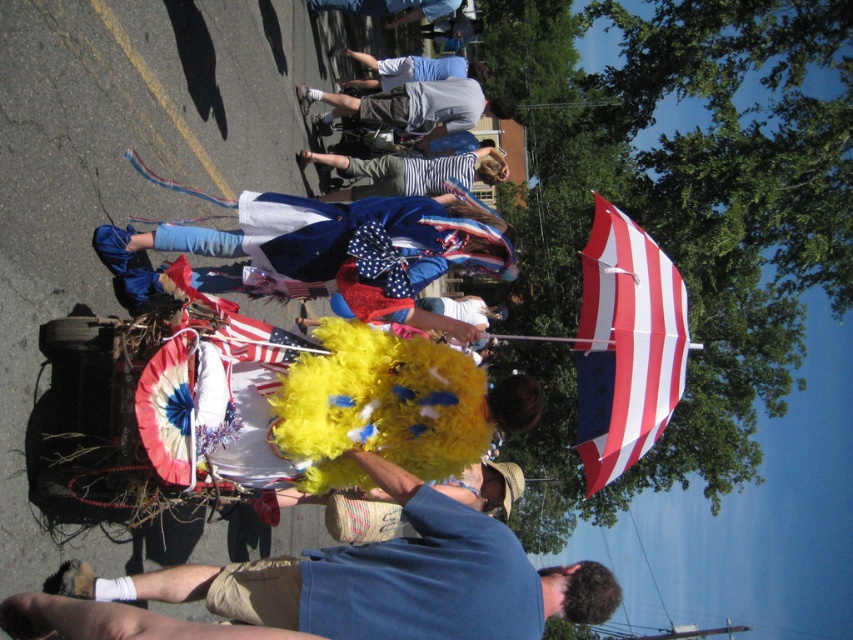
Question: Does red and white striped umbrella at upper right appear on the left side of striped fabric at center?

Choices:
 (A) no
 (B) yes

Answer: (A)

Question: Estimate the real-world distances between objects in this image. Which object is closer to the yellow fluffy costume at center?

Choices:
 (A) gray cotton shorts at center
 (B) blue fabric flag at center

Answer: (B)

Question: Is yellow fluffy costume at center above gray cotton shorts at center?

Choices:
 (A) no
 (B) yes

Answer: (A)

Question: Which of the following is the farthest from the observer?

Choices:
 (A) yellow fluffy costume at center
 (B) light blue cotton shirt at upper center
 (C) striped fabric at center

Answer: (B)

Question: Which point is closer to the camera?

Choices:
 (A) striped fabric at center
 (B) light blue cotton shirt at upper center

Answer: (A)

Question: Does yellow fluffy costume at center appear on the right side of red and white striped umbrella at upper right?

Choices:
 (A) yes
 (B) no

Answer: (B)